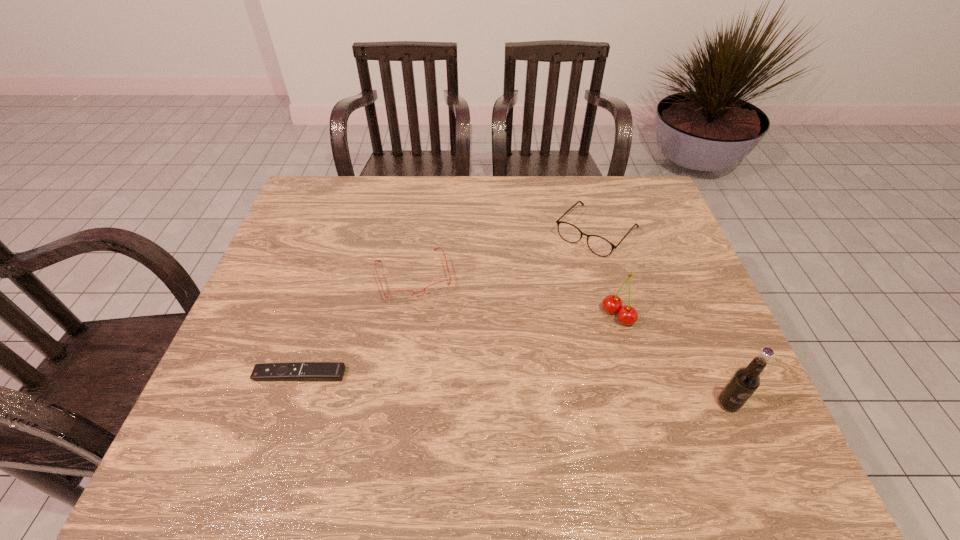
Where is `remote control at the near edge`? remote control at the near edge is located at coordinates (313, 371).

Locate an element on the screen. The width and height of the screenshot is (960, 540). root beer that is at the near edge is located at coordinates (743, 383).

Where is `object at the left edge`? The image size is (960, 540). object at the left edge is located at coordinates (313, 371).

Find the location of a particular element. This screenshot has height=540, width=960. root beer that is at the right edge is located at coordinates (743, 383).

Where is `spectacles present at the right edge`? spectacles present at the right edge is located at coordinates (600, 246).

The image size is (960, 540). I want to click on object that is positioned at the near left corner, so click(x=313, y=371).

Identify the location of object located at the far right corner. This screenshot has width=960, height=540. (600, 246).

Locate an element on the screen. object located in the near right corner section of the desktop is located at coordinates (743, 383).

The width and height of the screenshot is (960, 540). Identify the location of free space at the far edge of the desktop. (509, 184).

You are a GUI agent. You are given a task and a screenshot of the screen. Output one action in this format:
    pyautogui.click(x=<x>, y=<y>)
    Task: Click on the vacant position at the near edge of the desktop
    
    Given the screenshot: What is the action you would take?
    pyautogui.click(x=398, y=410)